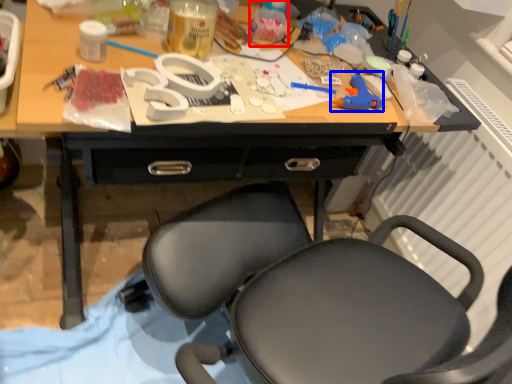
Question: Which object is closer to the camera taking this photo, bottle (highlighted by a red box) or toy (highlighted by a blue box)?

Choices:
 (A) bottle
 (B) toy

Answer: (B)